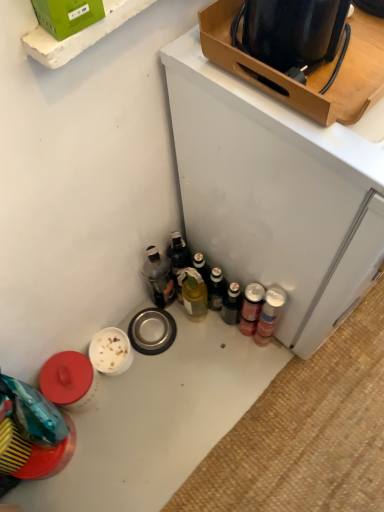
Where is `vacant space in front of translucent glass bottle at center, the second bottle when ordered from right to left`? The image size is (384, 512). vacant space in front of translucent glass bottle at center, the second bottle when ordered from right to left is located at coordinates (203, 364).